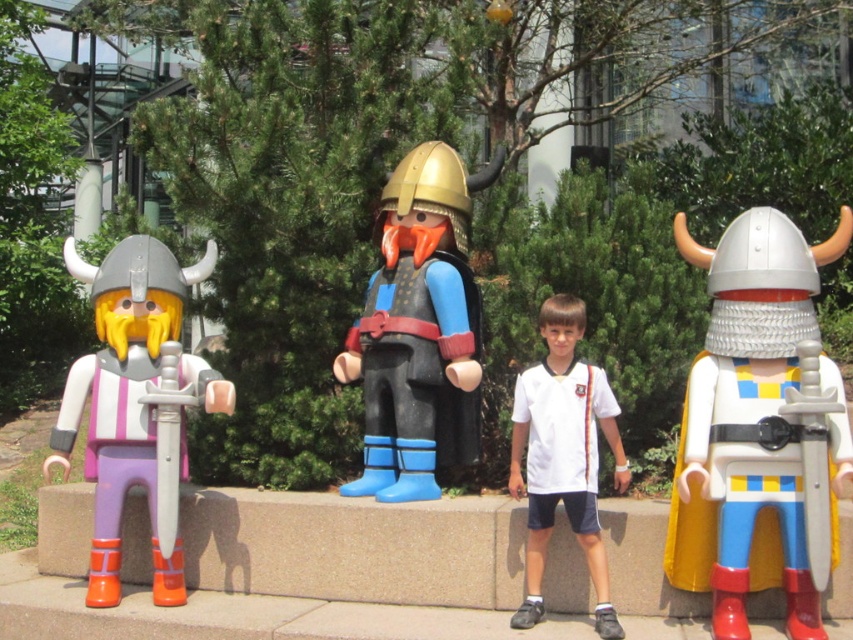
Looking at the Playmobil figures, which object is taller between the matte white helmet at center and the white smooth shirt at center?

The matte white helmet at center is taller than the white smooth shirt at center according to the description.

You are a child trying to stack the matte purple plastic viking at left and the white smooth shirt at center on top of each other. Which one should you place at the bottom to ensure stability?

The matte purple plastic viking at left should be placed at the bottom because it is larger than the white smooth shirt at center, providing a more stable base.

You are a photographer standing 5 meters away from the matte white helmet at center. You want to take a closer photo without moving the helmet. Can you move closer to get a better shot?

The matte white helmet at center is 4.04 meters away from the camera. Since you are currently 5 meters away, moving closer by 0.96 meters would allow you to reach the helmet and take a closer photo.